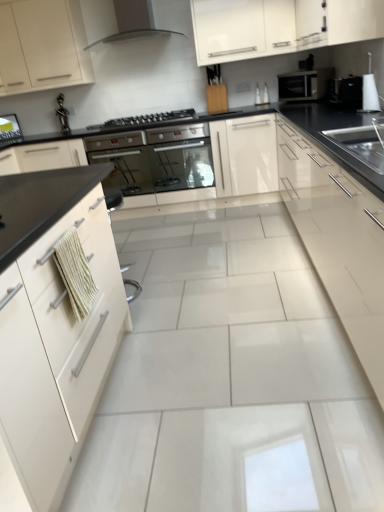
Question: Is satin black oven at center, the 1th oven in the right-to-left sequence, a part of black glossy microwave at upper right, which appears as the 1th appliance when viewed from the back?

Choices:
 (A) no
 (B) yes

Answer: (A)

Question: From the image's perspective, is black glossy microwave at upper right, which is the 2th appliance in front-to-back order, on satin black oven at center, the 1th oven in the right-to-left sequence?

Choices:
 (A) no
 (B) yes

Answer: (B)

Question: Does black glossy microwave at upper right, which appears as the 1th appliance when viewed from the back, appear on the right side of satin black oven at center, the 1th oven in the right-to-left sequence?

Choices:
 (A) no
 (B) yes

Answer: (B)

Question: Is black glossy microwave at upper right, which is the 2th appliance in front-to-back order, oriented away from satin black oven at center, the 1th oven in the right-to-left sequence?

Choices:
 (A) no
 (B) yes

Answer: (A)

Question: Is black glossy microwave at upper right, which appears as the 1th appliance when viewed from the back, behind satin black oven at center, the 1th oven in the right-to-left sequence?

Choices:
 (A) no
 (B) yes

Answer: (A)

Question: From the image's perspective, does black glossy microwave at upper right, which is the 2th appliance in front-to-back order, appear lower than satin black oven at center, the 1th oven in the right-to-left sequence?

Choices:
 (A) no
 (B) yes

Answer: (A)

Question: Is the position of white glossy kettle at upper right, the 2th appliance when ordered from back to front, more distant than that of matte black range hood at upper center?

Choices:
 (A) no
 (B) yes

Answer: (A)

Question: Is white glossy kettle at upper right, the 2th appliance when ordered from back to front, far away from matte black range hood at upper center?

Choices:
 (A) yes
 (B) no

Answer: (A)

Question: Is white glossy kettle at upper right, the 2th appliance when ordered from back to front, not within matte black range hood at upper center?

Choices:
 (A) yes
 (B) no

Answer: (A)

Question: Can you confirm if white glossy kettle at upper right, the 2th appliance when ordered from back to front, is wider than matte black range hood at upper center?

Choices:
 (A) no
 (B) yes

Answer: (A)

Question: Can you confirm if white glossy kettle at upper right, the 2th appliance when ordered from back to front, is positioned to the right of matte black range hood at upper center?

Choices:
 (A) no
 (B) yes

Answer: (B)

Question: Does white glossy kettle at upper right, which is counted as the 1th appliance, starting from the front, have a lesser width compared to matte black range hood at upper center?

Choices:
 (A) no
 (B) yes

Answer: (B)

Question: Is white glossy kettle at upper right, which is counted as the 1th appliance, starting from the front, next to white glossy cabinet at left, placed as the 2th cabinetry when sorted from left to right, and touching it?

Choices:
 (A) no
 (B) yes

Answer: (A)